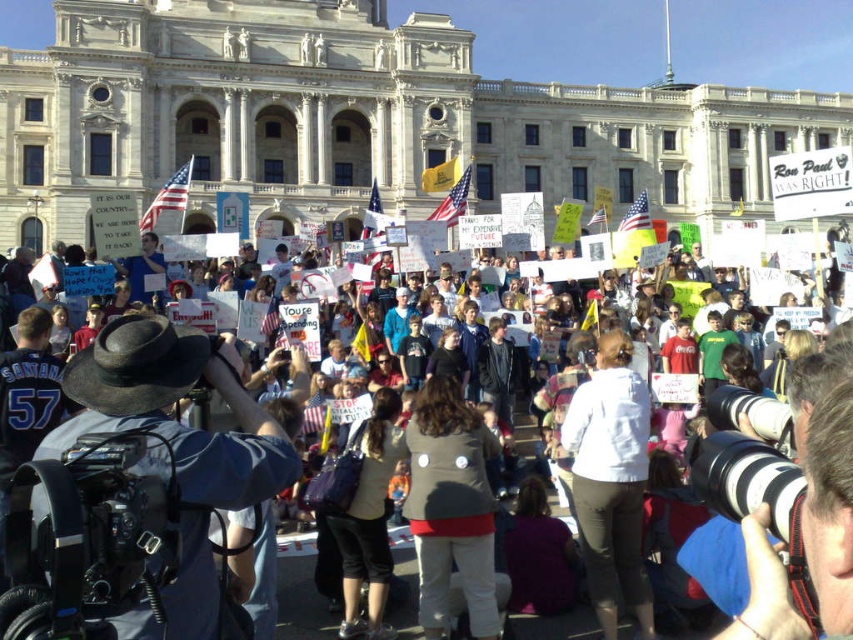
You are a photographer trying to capture a clear shot of the white paper signs at center. There is a person wearing a gray fabric jacket at center blocking your view. Can you estimate whether the jacket is thin enough to still see the signs through it?

The gray fabric jacket at center is thinner than white paper signs at center, so it might be possible to see the signs through the jacket if the material is translucent. However, since the jacket is an object worn by a person, it would physically block the view unless moved or the photographer repositions.

You are a photographer at the protest scene. You need to capture a photo that includes both the denim jacket at lower left and the matte brown jacket at center. Which jacket will appear closer to the camera in the final photo?

The denim jacket at lower left is positioned over the matte brown jacket at center, so it will appear closer to the camera in the photo.